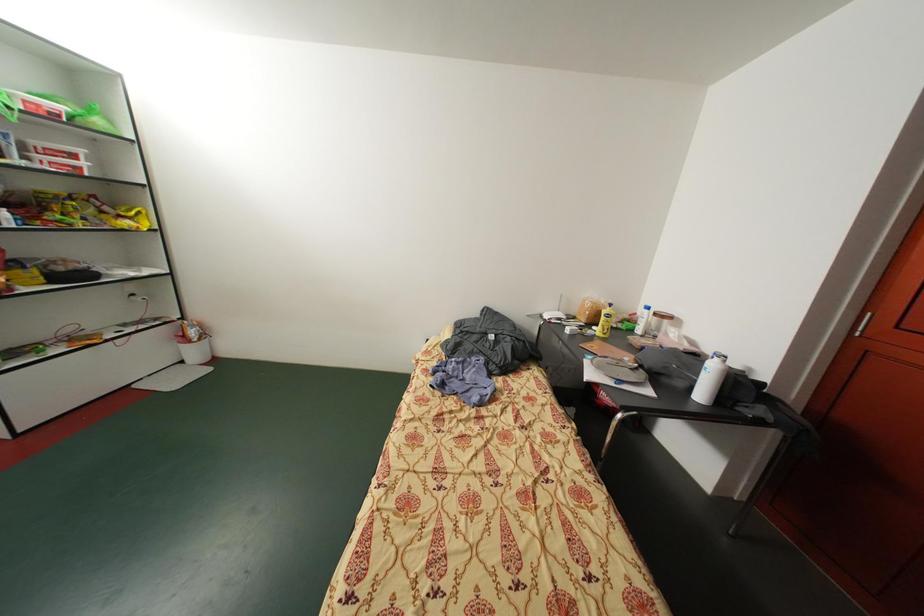
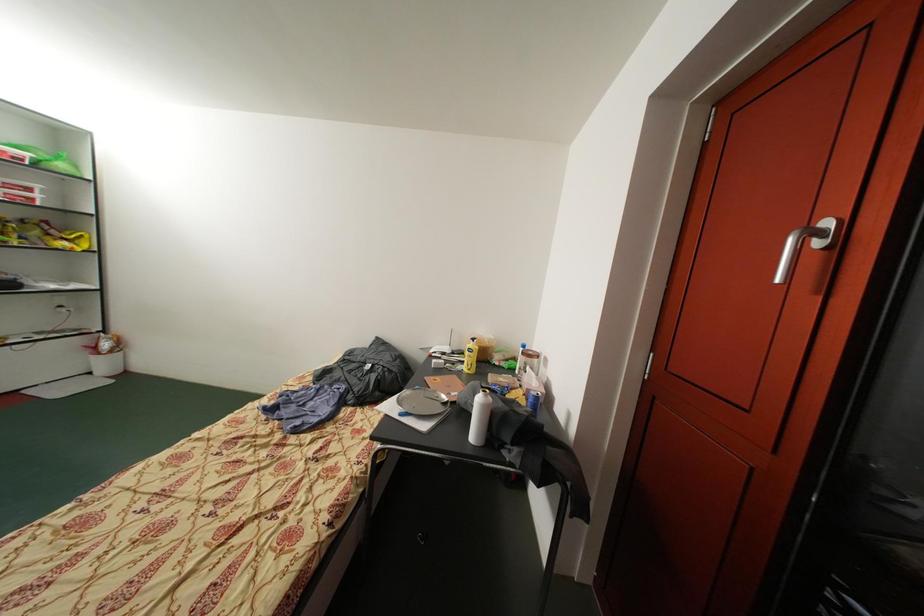
Question: The images are taken continuously from a first-person perspective. In which direction are you moving?

Choices:
 (A) Left
 (B) Right
 (C) Forward
 (D) Backward

Answer: (B)